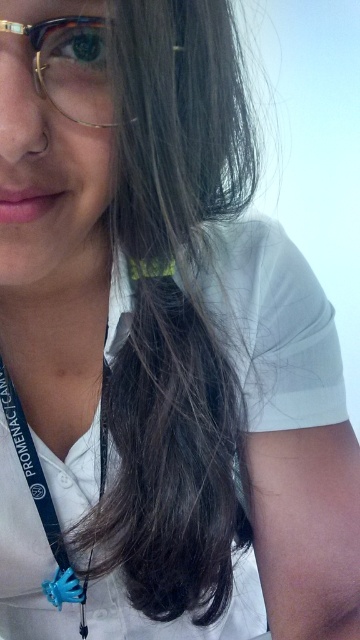
Can you confirm if white fabric at center is shorter than tortoiseshell acetate glasses at upper left?

In fact, white fabric at center may be taller than tortoiseshell acetate glasses at upper left.

Between white fabric at center and tortoiseshell acetate glasses at upper left, which one has less height?

With less height is tortoiseshell acetate glasses at upper left.

Describe the element at coordinates (59, 340) in the screenshot. I see `white fabric at center` at that location.

The height and width of the screenshot is (640, 360). Identify the location of white fabric at center. (59, 340).

Which of these two, white fabric at center or blue rubber lanyard at center, stands shorter?

With less height is white fabric at center.

Between white fabric at center and blue rubber lanyard at center, which one appears on the right side from the viewer's perspective?

blue rubber lanyard at center is more to the right.

Which is in front, point (65, 397) or point (60, 531)?

Positioned in front is point (60, 531).

Identify the location of white fabric at center. This screenshot has width=360, height=640. (59, 340).

Does tortoiseshell acetate glasses at upper left appear over blue rubber lanyard at center?

Indeed, tortoiseshell acetate glasses at upper left is positioned over blue rubber lanyard at center.

Is tortoiseshell acetate glasses at upper left taller than blue rubber lanyard at center?

No.

Locate an element on the screen. The height and width of the screenshot is (640, 360). tortoiseshell acetate glasses at upper left is located at coordinates (70, 67).